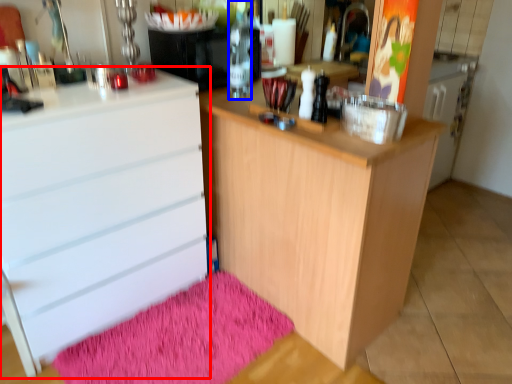
Question: Which point is closer to the camera, chest of drawers (highlighted by a red box) or bottle (highlighted by a blue box)?

Choices:
 (A) chest of drawers
 (B) bottle

Answer: (A)